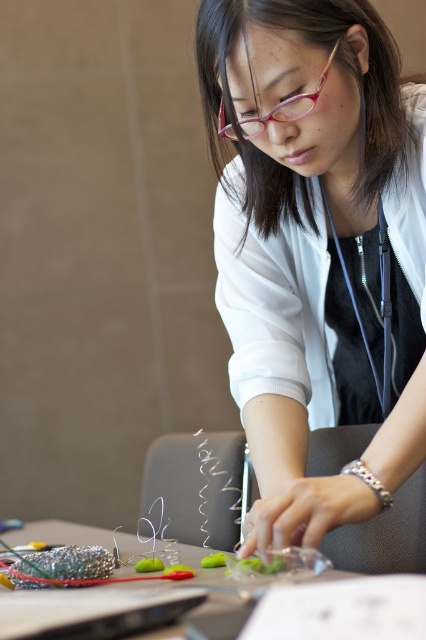
You are a fashion designer analyzing the image. You need to place a pin exactly at the center of the white matte shirt at center. What are the coordinates where you should place the pin?

The coordinates for the center of the white matte shirt at center are at point (317, 250).

You are a fashion designer observing a workspace. You notice the white matte shirt at center and the clear plastic table at lower center. Which object would require more fabric or material to create based on their sizes?

The white matte shirt at center is larger in size than the clear plastic table at lower center, so it would require more fabric or material to create.

You are a photographer trying to capture the clear plastic table at lower center in your shot. However, the white matte shirt at center is blocking your view. Can you adjust your angle to see the table without moving any objects?

The white matte shirt at center is above the clear plastic table at lower center, so by lowering your camera angle slightly, you can position it below the shirt to capture the table without moving anything.